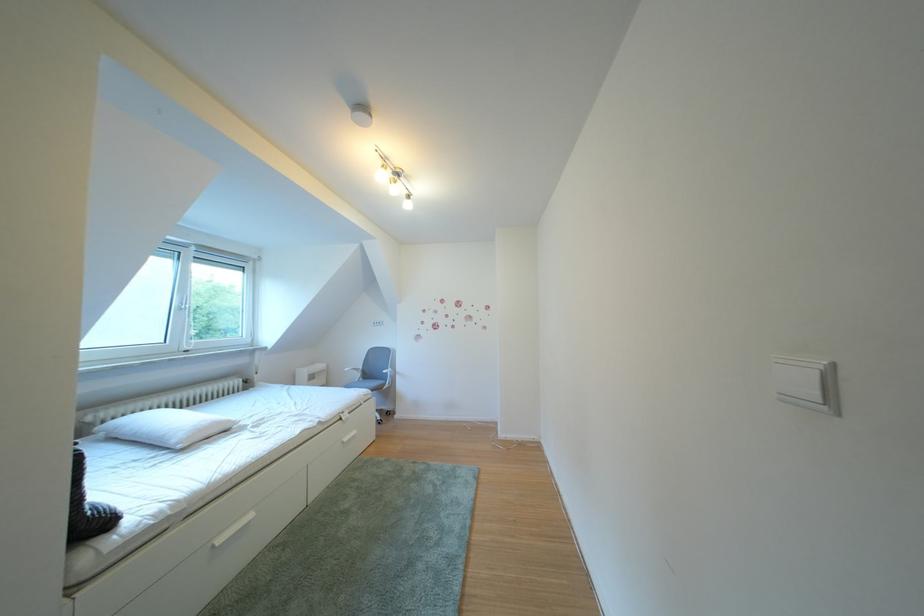
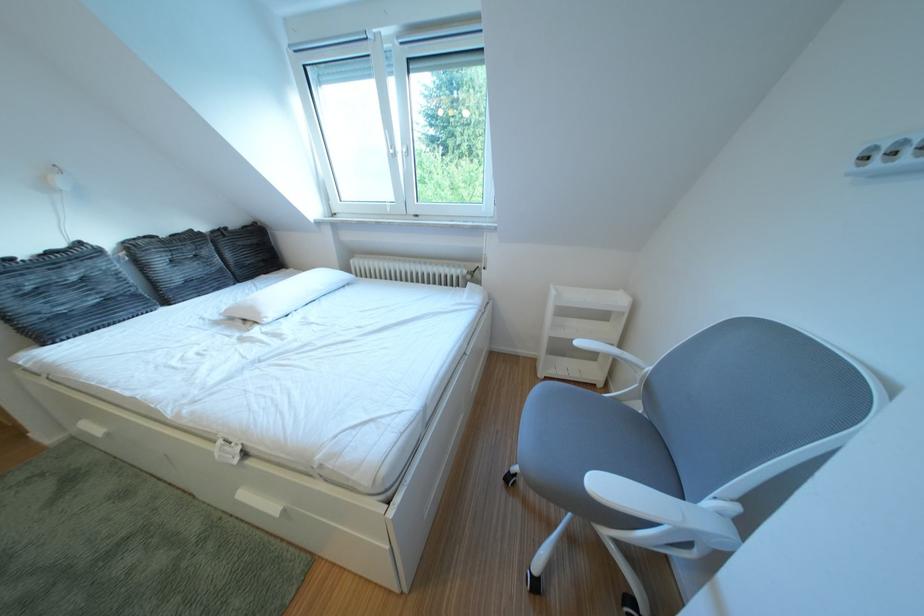
Find the pixel in the second image that matches point (242, 427) in the first image.

(273, 318)